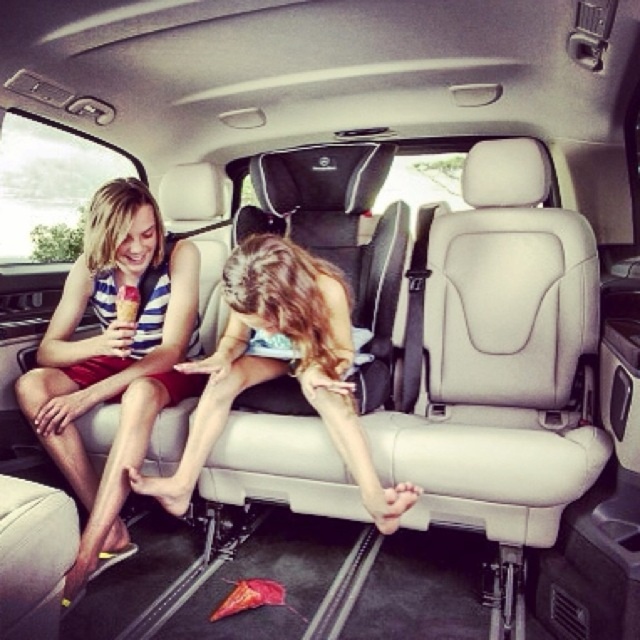
Question: Can you confirm if matte striped tank top at left is smaller than matte skin girl at center?

Choices:
 (A) yes
 (B) no

Answer: (B)

Question: Is matte striped tank top at left above matte skin girl at center?

Choices:
 (A) no
 (B) yes

Answer: (A)

Question: Among these points, which one is nearest to the camera?

Choices:
 (A) (298, 252)
 (B) (184, 296)

Answer: (A)

Question: Which of the following is the closest to the observer?

Choices:
 (A) (112, 237)
 (B) (250, 298)

Answer: (B)

Question: Can you confirm if matte striped tank top at left is positioned below matte skin girl at center?

Choices:
 (A) no
 (B) yes

Answer: (B)